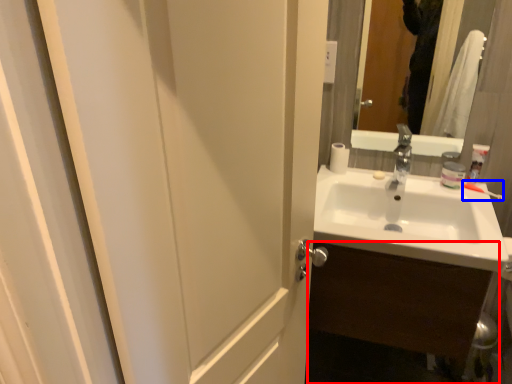
Question: Which object appears closest to the camera in this image, bathroom cabinet (highlighted by a red box) or toothbrush (highlighted by a blue box)?

Choices:
 (A) bathroom cabinet
 (B) toothbrush

Answer: (A)